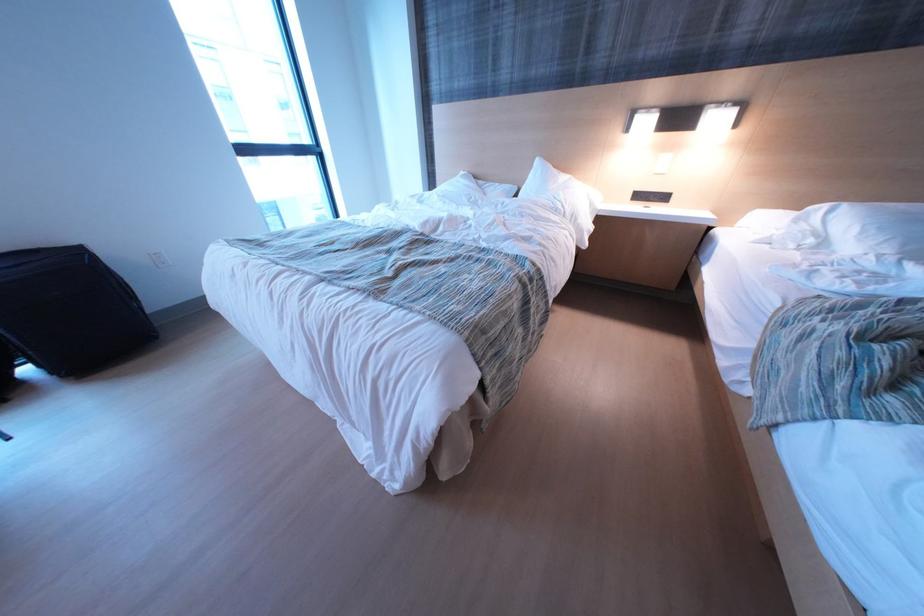
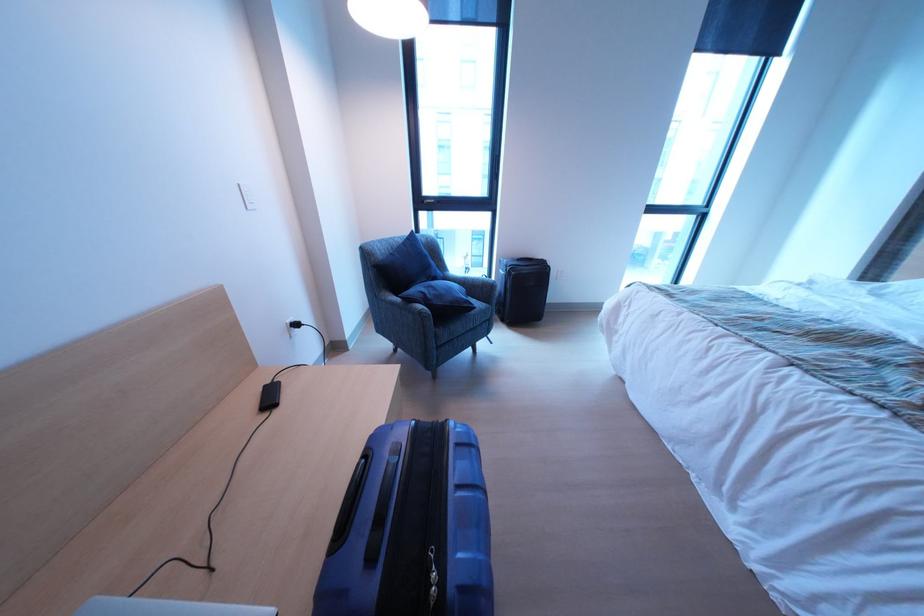
Question: The camera is either moving clockwise (left) or counter-clockwise (right) around the object. The first image is from the beginning of the video and the second image is from the end. Is the camera moving left or right when shooting the video?

Choices:
 (A) Left
 (B) Right

Answer: (B)